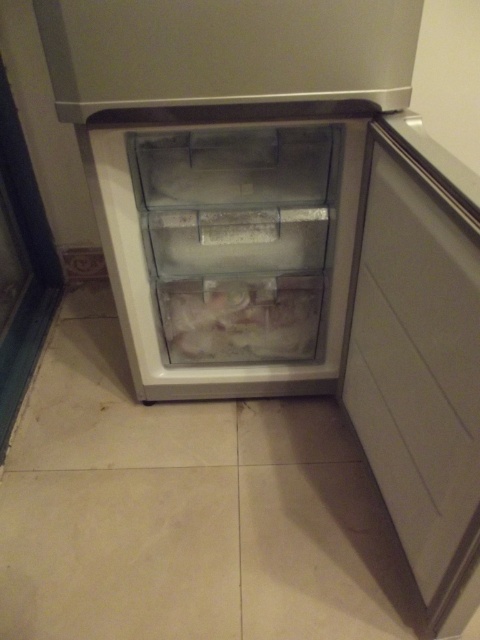
You are standing in front of the refrigerator freezer unit and need to reach the white matte door at right. Based on the distance provided, can you estimate whether you can comfortably reach it without moving your feet?

The white matte door at right is 28.32 inches away from the viewer. Since this distance is within typical comfortable reaching range for most adults, you can likely reach it without moving your feet.

You are trying to reach the frozen white food at center in the freezer. The white matte door at right is part of the freezer. Is the door in the way of accessing the frozen white food?

The white matte door at right is below frozen white food at center, so the door is not in the way of accessing the frozen white food at center. You can reach the frozen white food at center without opening the door.